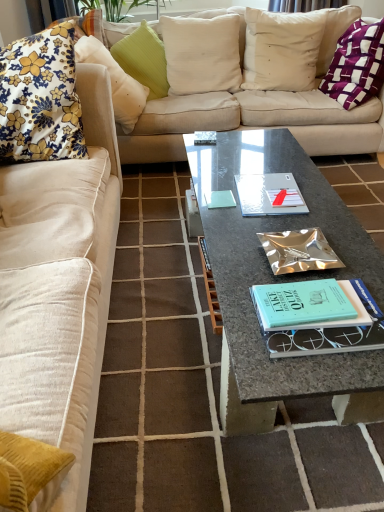
Locate an element on the screen. The width and height of the screenshot is (384, 512). blank space to the left of metallic silver book at center is located at coordinates (234, 253).